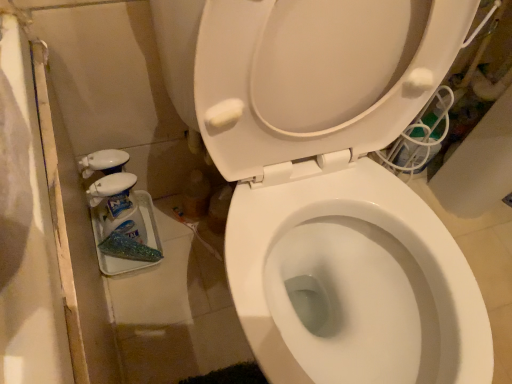
Measure the distance between point (225,38) and camera.

The distance of point (225,38) from camera is 18.39 inches.

Find the location of a particular element. white glossy toilet at center is located at coordinates (329, 183).

In order to face white glossy toilet at center, should I rotate leftwards or rightwards?

To align with it, rotate right about 11.606°.

Image resolution: width=512 pixels, height=384 pixels. What do you see at coordinates (329, 183) in the screenshot?
I see `white glossy toilet at center` at bounding box center [329, 183].

Identify the location of white glossy toilet at center. The height and width of the screenshot is (384, 512). (329, 183).